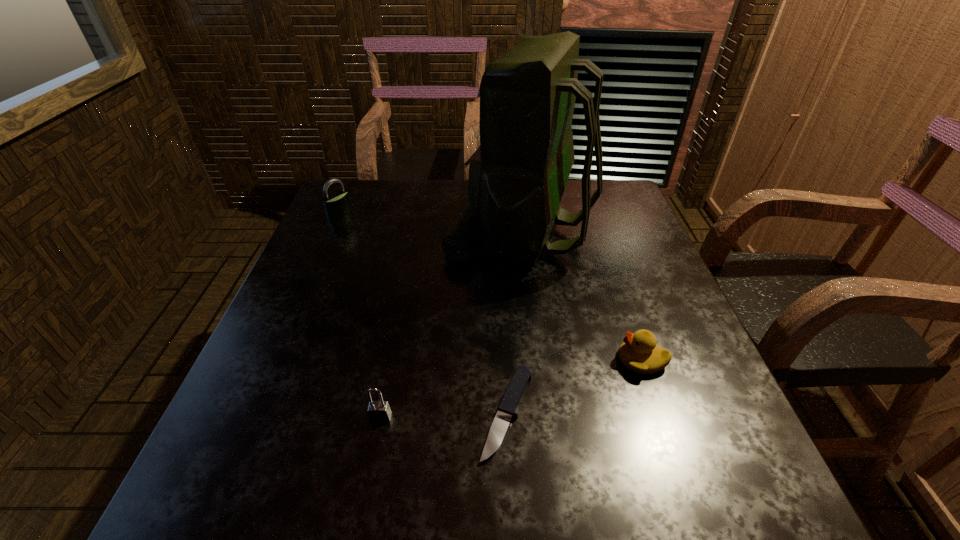
At what (x,y) coordinates should I click in order to perform the action: click on the tallest object. Please return your answer as a coordinate pair (x, y). This screenshot has width=960, height=540. Looking at the image, I should click on (517, 176).

Image resolution: width=960 pixels, height=540 pixels. I want to click on the leftmost object, so click(336, 206).

Where is `the left padlock`? the left padlock is located at coordinates (336, 206).

At what (x,y) coordinates should I click in order to perform the action: click on the shorter padlock. Please return your answer as a coordinate pair (x, y). This screenshot has width=960, height=540. Looking at the image, I should click on (378, 411).

Locate an element on the screen. the right padlock is located at coordinates (378, 411).

The image size is (960, 540). In order to click on duckling in this screenshot , I will do `click(639, 352)`.

Locate an element on the screen. Image resolution: width=960 pixels, height=540 pixels. steak knife is located at coordinates (506, 411).

This screenshot has width=960, height=540. Find the location of `free space located on the front of the tallest object with visible pockets`. free space located on the front of the tallest object with visible pockets is located at coordinates (318, 232).

Find the location of `vacant space located on the front of the tallest object with visible pockets`. vacant space located on the front of the tallest object with visible pockets is located at coordinates (318, 232).

I want to click on vacant area situated 0.330m on the front of the tallest object with visible pockets, so click(x=325, y=232).